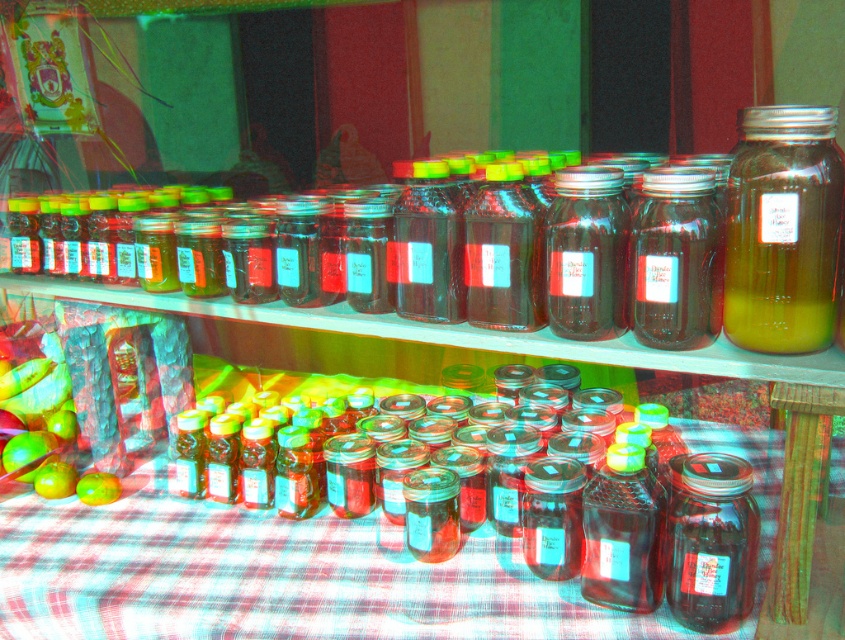
Question: Among these objects, which one is nearest to the camera?

Choices:
 (A) green matte apple at lower left
 (B) transparent glass jar at lower right
 (C) clear glass jar at right
 (D) transparent glass jars at center

Answer: (C)

Question: Does transparent glass jars at center have a smaller size compared to transparent glass jar at lower right?

Choices:
 (A) yes
 (B) no

Answer: (B)

Question: Which point is closer to the camera taking this photo?

Choices:
 (A) (718, 563)
 (B) (767, 259)
 (C) (142, 589)
 (D) (77, 484)

Answer: (B)

Question: From the image, what is the correct spatial relationship of transparent glass jars at center in relation to clear glass jar at right?

Choices:
 (A) left
 (B) right

Answer: (A)

Question: Does transparent glass jars at center appear over green matte apple at lower left?

Choices:
 (A) no
 (B) yes

Answer: (A)

Question: Based on their relative distances, which object is nearer to the green matte apple at lower left?

Choices:
 (A) transparent glass jar at lower right
 (B) transparent glass jars at center
 (C) clear glass jar at right

Answer: (B)